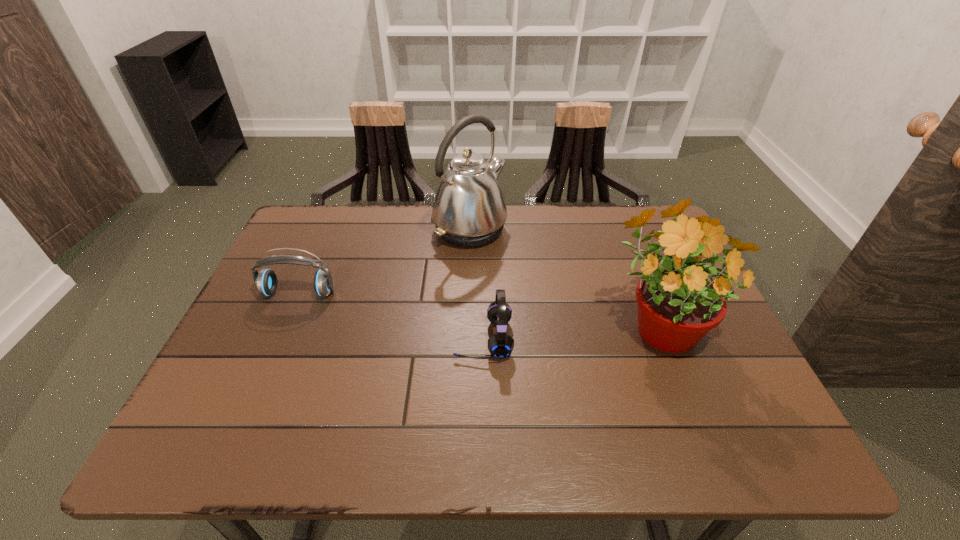
Image resolution: width=960 pixels, height=540 pixels. Find the location of `vacant area that lies between the leftmost object and the flowerpot`. vacant area that lies between the leftmost object and the flowerpot is located at coordinates (479, 308).

I want to click on free point between the flowerpot and the farthest object, so click(564, 277).

Locate an element on the screen. The image size is (960, 540). free space that is in between the farthest object and the flowerpot is located at coordinates (564, 277).

I want to click on vacant area that lies between the nearer headset and the farthest object, so click(x=476, y=284).

I want to click on vacant region between the kettle and the nearer headset, so click(x=476, y=284).

Where is `free space that is in between the farther headset and the right headset`? The height and width of the screenshot is (540, 960). free space that is in between the farther headset and the right headset is located at coordinates (391, 316).

The height and width of the screenshot is (540, 960). I want to click on unoccupied area between the flowerpot and the nearer headset, so click(x=571, y=331).

Where is `vacant region between the left headset and the kettle`? This screenshot has height=540, width=960. vacant region between the left headset and the kettle is located at coordinates (384, 261).

Locate which object is the second closest to the right headset. Please provide its 2D coordinates. Your answer should be formatted as a tuple, i.e. [(x, y)], where the tuple contains the x and y coordinates of a point satisfying the conditions above.

[(469, 210)]

Identify which object is the third closest to the kettle. Please provide its 2D coordinates. Your answer should be formatted as a tuple, i.e. [(x, y)], where the tuple contains the x and y coordinates of a point satisfying the conditions above.

[(266, 281)]